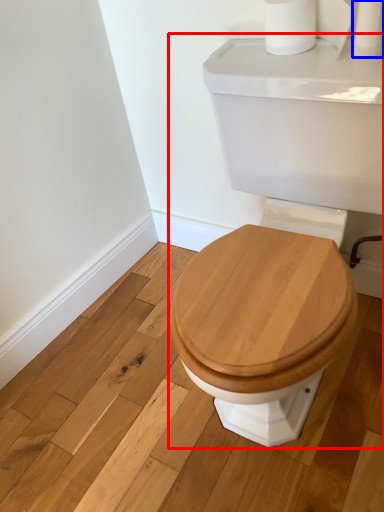
Question: Which of the following is the closest to the observer, porcelain (highlighted by a red box) or toilet paper (highlighted by a blue box)?

Choices:
 (A) porcelain
 (B) toilet paper

Answer: (A)